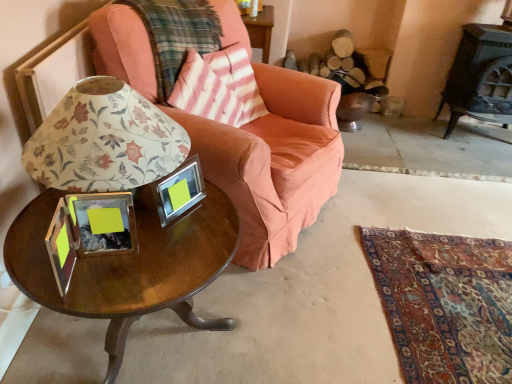
Image resolution: width=512 pixels, height=384 pixels. Find the location of `vacant space underneath shiny brown wood coffee table at lower left (from a real-world perspective)`. vacant space underneath shiny brown wood coffee table at lower left (from a real-world perspective) is located at coordinates (153, 342).